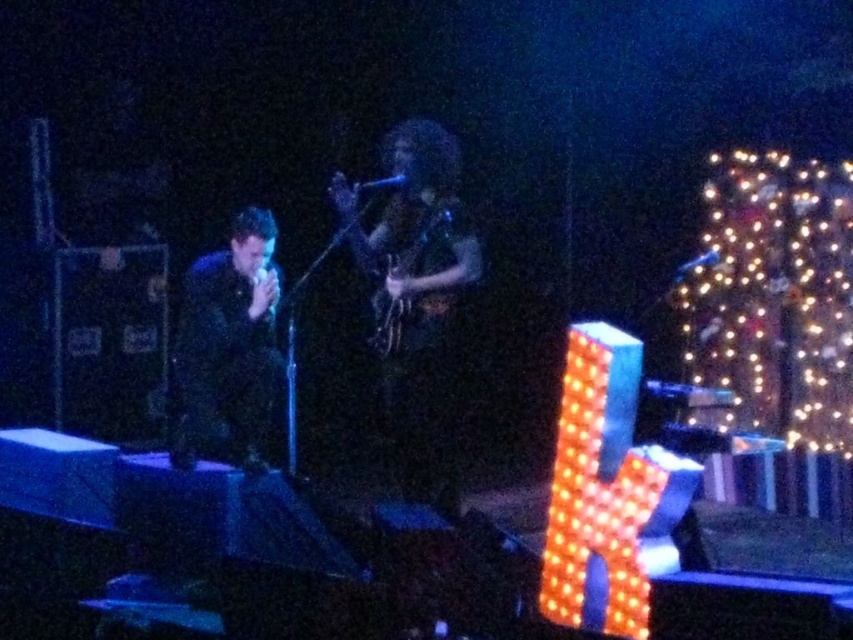
Question: Considering the relative positions of shiny black guitar at center and black matte suit at left in the image provided, where is shiny black guitar at center located with respect to black matte suit at left?

Choices:
 (A) left
 (B) right

Answer: (B)

Question: Does shiny black guitar at center appear under black matte suit at left?

Choices:
 (A) yes
 (B) no

Answer: (B)

Question: Which point is closer to the camera?

Choices:
 (A) shiny black guitar at center
 (B) black matte suit at left

Answer: (B)

Question: Among these objects, which one is nearest to the camera?

Choices:
 (A) shiny black guitar at center
 (B) black matte suit at left

Answer: (B)

Question: Is shiny black guitar at center further to camera compared to black matte suit at left?

Choices:
 (A) yes
 (B) no

Answer: (A)

Question: Which of the following is the closest to the observer?

Choices:
 (A) (383, 340)
 (B) (173, 381)

Answer: (A)